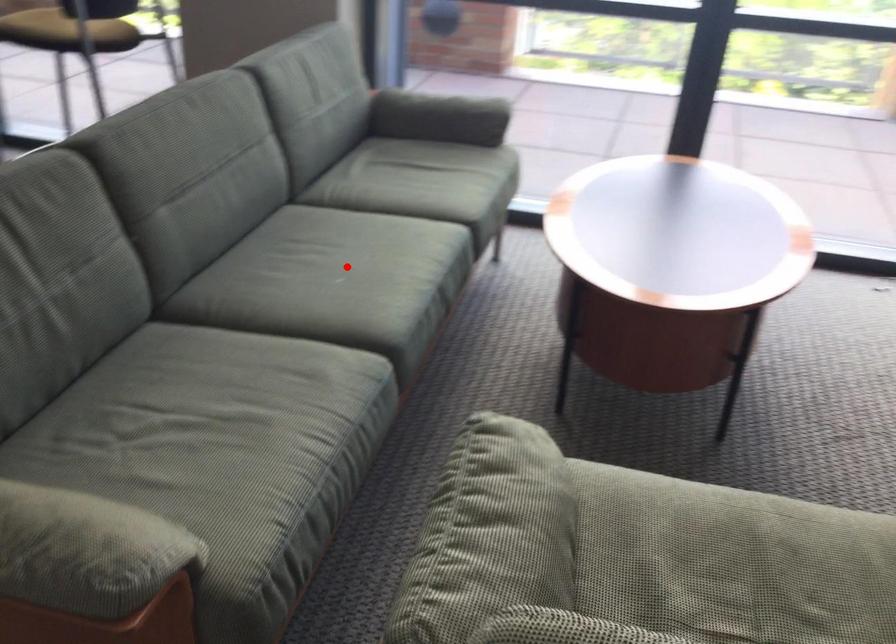
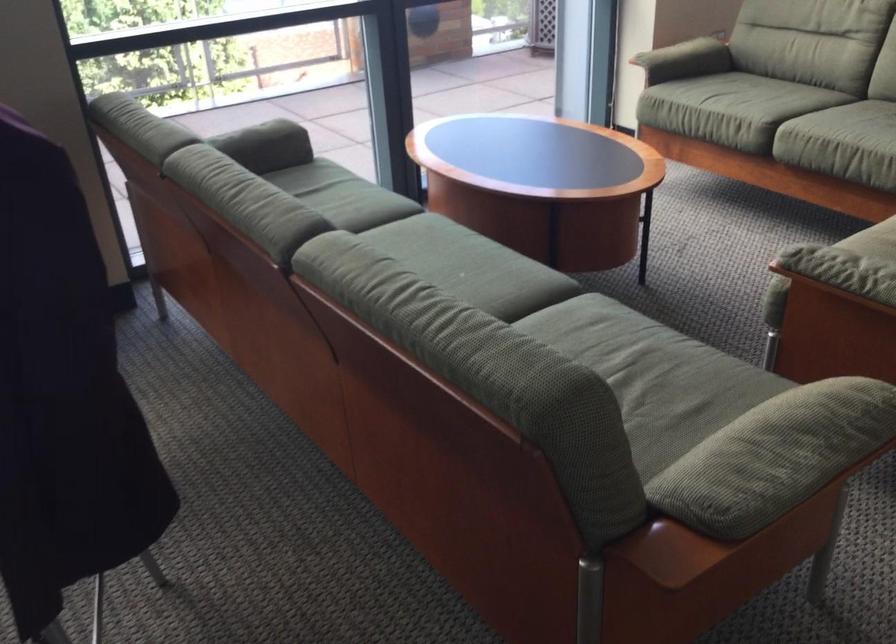
Find the pixel in the second image that matches the highlighted location in the first image.

(442, 267)